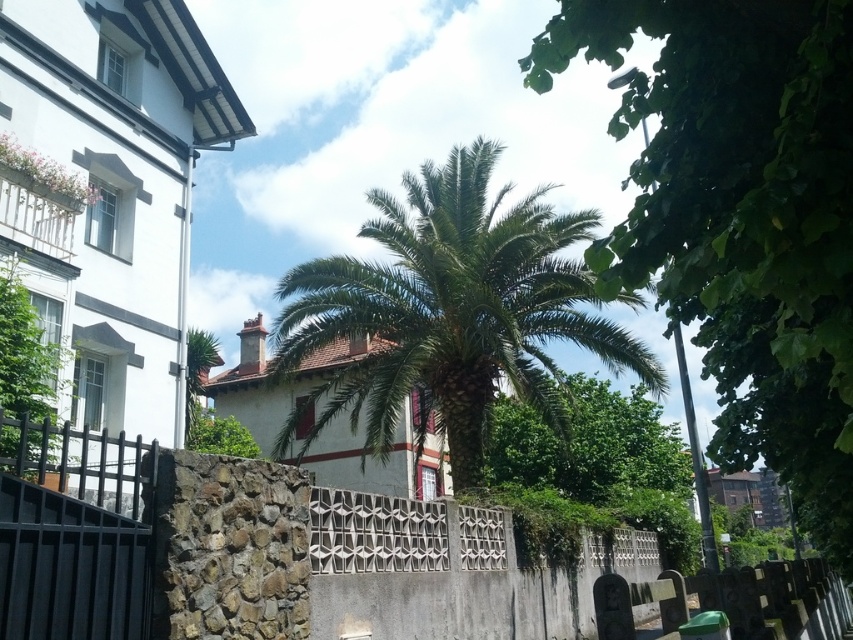
Image resolution: width=853 pixels, height=640 pixels. Describe the element at coordinates (741, 216) in the screenshot. I see `green leafy tree at center` at that location.

Does green leafy tree at center appear on the right side of stone textured fence at center?

Indeed, green leafy tree at center is positioned on the right side of stone textured fence at center.

This screenshot has height=640, width=853. Identify the location of green leafy tree at center. (741, 216).

The image size is (853, 640). In order to click on green leafy tree at center in this screenshot , I will do `click(741, 216)`.

Image resolution: width=853 pixels, height=640 pixels. Find the location of `stone textured fence at center`. stone textured fence at center is located at coordinates (265, 552).

Which of these two, stone textured fence at center or white stone fence at lower right, stands shorter?

stone textured fence at center is shorter.

Is point (82, 516) positioned in front of point (714, 589)?

Yes, point (82, 516) is in front of point (714, 589).

Find the location of a particular element. Image resolution: width=853 pixels, height=640 pixels. stone textured fence at center is located at coordinates 265,552.

Based on the photo, how far apart are stone textured fence at center and green leafy palm at center?

stone textured fence at center is 4.94 meters away from green leafy palm at center.

Is point (10, 433) closer to viewer compared to point (431, 221)?

Yes.

Identify the location of stone textured fence at center. (265, 552).